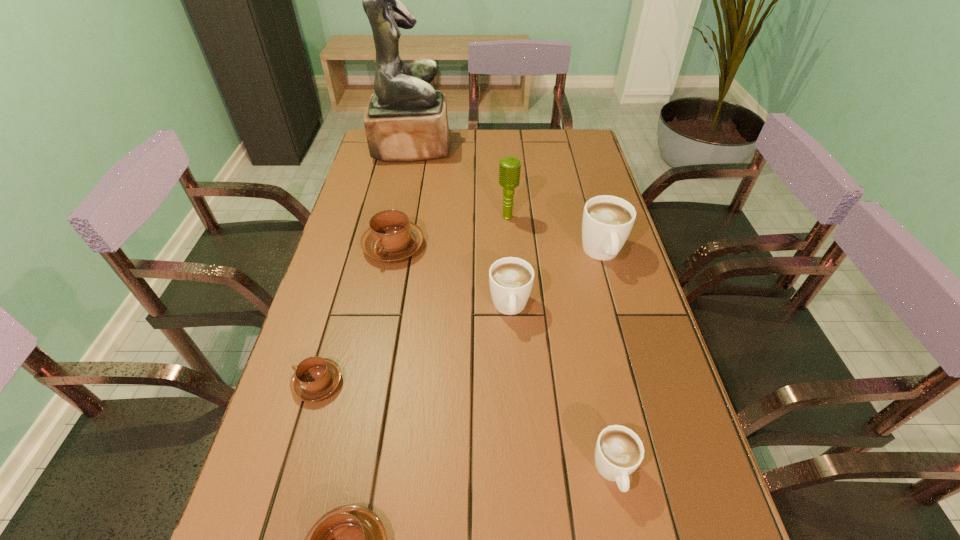
The height and width of the screenshot is (540, 960). What are the coordinates of `object located at the far left corner` in the screenshot? It's located at (406, 120).

The width and height of the screenshot is (960, 540). I want to click on vacant region at the far edge, so click(503, 132).

I want to click on free space at the left edge of the desktop, so click(x=313, y=344).

Image resolution: width=960 pixels, height=540 pixels. Find the location of `free region at the right edge of the desktop`. free region at the right edge of the desktop is located at coordinates (582, 168).

You are a GUI agent. You are given a task and a screenshot of the screen. Output one action in this format:
    pyautogui.click(x=<x>, y=<y>)
    Task: Click on the free location at the far right corner
    
    Given the screenshot: What is the action you would take?
    pyautogui.click(x=569, y=139)

At what (x,y) coordinates should I click in order to perform the action: click on vacant area that lies between the fifth farthest cappuccino and the third nearest object. Please return your answer as a coordinate pair (x, y). Looking at the image, I should click on (466, 427).

Where is `free point between the biggest white cappuccino and the nearest white cappuccino`? Image resolution: width=960 pixels, height=540 pixels. free point between the biggest white cappuccino and the nearest white cappuccino is located at coordinates (608, 362).

Locate an element on the screen. free space between the sixth shortest object and the seventh shortest object is located at coordinates (555, 235).

Image resolution: width=960 pixels, height=540 pixels. Identify the location of free space between the farthest brown cappuccino and the sculpture. (403, 197).

Where is `empty space between the second farthest object and the biggest brown cappuccino`? Image resolution: width=960 pixels, height=540 pixels. empty space between the second farthest object and the biggest brown cappuccino is located at coordinates (450, 232).